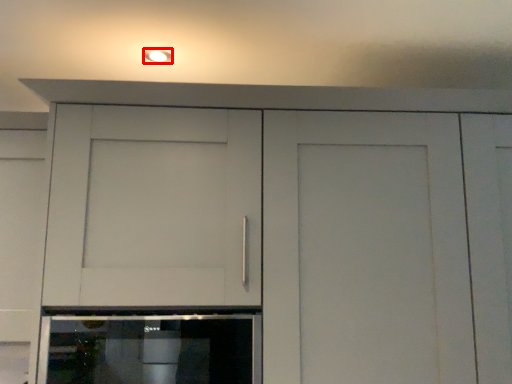
Question: From the image, what is the correct spatial relationship of lighting (annotated by the red box) in relation to home appliance?

Choices:
 (A) right
 (B) left

Answer: (B)